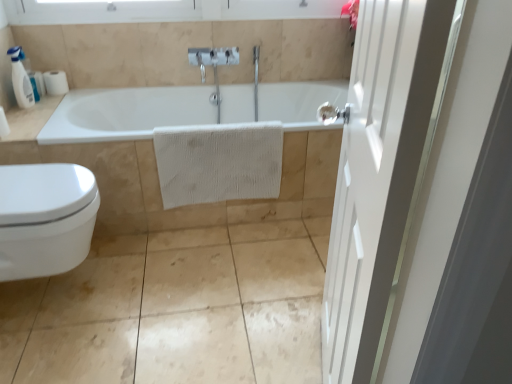
Question: Is white glossy bidet at lower left positioned in front of white matte toilet paper at upper left?

Choices:
 (A) yes
 (B) no

Answer: (A)

Question: Does white glossy bidet at lower left come behind white matte toilet paper at upper left?

Choices:
 (A) no
 (B) yes

Answer: (A)

Question: From the image's perspective, is white glossy bidet at lower left located beneath white matte toilet paper at upper left?

Choices:
 (A) no
 (B) yes

Answer: (B)

Question: Considering the relative sizes of white glossy bidet at lower left and white matte toilet paper at upper left in the image provided, is white glossy bidet at lower left wider than white matte toilet paper at upper left?

Choices:
 (A) yes
 (B) no

Answer: (A)

Question: Is white glossy bidet at lower left surrounding white matte toilet paper at upper left?

Choices:
 (A) no
 (B) yes

Answer: (A)

Question: From a real-world perspective, relative to white plastic soap dispenser at upper left, is white matte toilet paper at upper left vertically above or below?

Choices:
 (A) above
 (B) below

Answer: (B)

Question: Considering their positions, is white matte toilet paper at upper left located in front of or behind white plastic soap dispenser at upper left?

Choices:
 (A) front
 (B) behind

Answer: (B)

Question: In terms of width, does white matte toilet paper at upper left look wider or thinner when compared to white plastic soap dispenser at upper left?

Choices:
 (A) thin
 (B) wide

Answer: (B)

Question: Considering the positions of white matte toilet paper at upper left and white plastic soap dispenser at upper left in the image, is white matte toilet paper at upper left bigger or smaller than white plastic soap dispenser at upper left?

Choices:
 (A) small
 (B) big

Answer: (A)

Question: Considering the positions of point (354, 230) and point (51, 82), is point (354, 230) closer or farther from the camera than point (51, 82)?

Choices:
 (A) farther
 (B) closer

Answer: (B)

Question: Looking at the image, does white wooden door at right seem bigger or smaller compared to white matte toilet paper at upper left?

Choices:
 (A) big
 (B) small

Answer: (A)

Question: From their relative heights in the image, would you say white wooden door at right is taller or shorter than white matte toilet paper at upper left?

Choices:
 (A) tall
 (B) short

Answer: (A)

Question: Is white wooden door at right inside the boundaries of white matte toilet paper at upper left, or outside?

Choices:
 (A) inside
 (B) outside

Answer: (B)

Question: In terms of width, does white matte toilet paper at upper left look wider or thinner when compared to white glossy counter top at upper left?

Choices:
 (A) wide
 (B) thin

Answer: (B)

Question: From their relative heights in the image, would you say white matte toilet paper at upper left is taller or shorter than white glossy counter top at upper left?

Choices:
 (A) tall
 (B) short

Answer: (A)